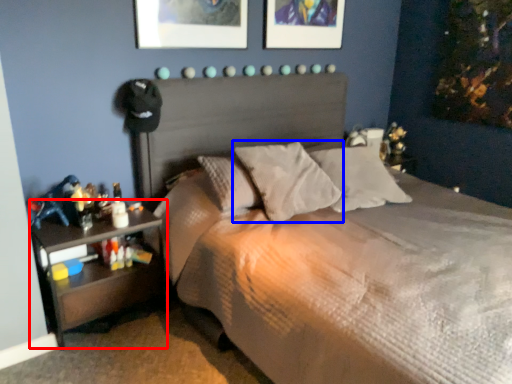
Question: Which of the following is the farthest to the observer, nightstand (highlighted by a red box) or pillow (highlighted by a blue box)?

Choices:
 (A) nightstand
 (B) pillow

Answer: (B)